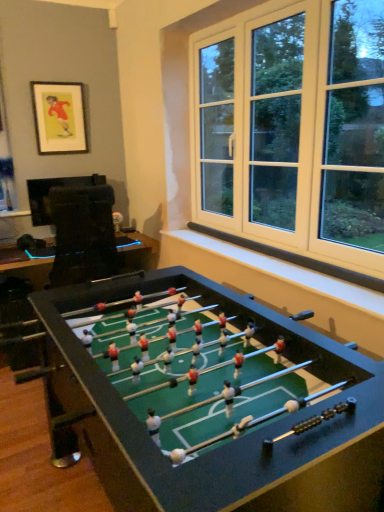
Question: Which direction should I rotate to look at green felt table at center, the first table in the bottom-to-top sequence?

Choices:
 (A) left
 (B) right

Answer: (A)

Question: Is green felt table at center, the second table viewed from the top, not near matte black picture frame at upper left?

Choices:
 (A) yes
 (B) no

Answer: (A)

Question: From the image's perspective, would you say green felt table at center, the second table viewed from the top, is positioned over matte black picture frame at upper left?

Choices:
 (A) no
 (B) yes

Answer: (A)

Question: Is green felt table at center, the first table in the bottom-to-top sequence, bigger than matte black picture frame at upper left?

Choices:
 (A) yes
 (B) no

Answer: (A)

Question: Is green felt table at center, the second table viewed from the top, smaller than matte black picture frame at upper left?

Choices:
 (A) yes
 (B) no

Answer: (B)

Question: Are green felt table at center, the second table viewed from the top, and matte black picture frame at upper left making contact?

Choices:
 (A) yes
 (B) no

Answer: (B)

Question: Can you confirm if green felt table at center, the first table in the bottom-to-top sequence, is positioned to the left of matte black picture frame at upper left?

Choices:
 (A) no
 (B) yes

Answer: (A)

Question: Considering the relative sizes of green felt table at center, the second table viewed from the top, and black glossy tv at left, the 2th table from the bottom, in the image provided, is green felt table at center, the second table viewed from the top, bigger than black glossy tv at left, the 2th table from the bottom,?

Choices:
 (A) no
 (B) yes

Answer: (B)

Question: From a real-world perspective, is green felt table at center, the first table in the bottom-to-top sequence, physically below black glossy tv at left, positioned as the 1th table in top-to-bottom order?

Choices:
 (A) no
 (B) yes

Answer: (B)

Question: Considering the relative sizes of green felt table at center, the second table viewed from the top, and black glossy tv at left, positioned as the 1th table in top-to-bottom order, in the image provided, is green felt table at center, the second table viewed from the top, shorter than black glossy tv at left, positioned as the 1th table in top-to-bottom order,?

Choices:
 (A) yes
 (B) no

Answer: (A)

Question: Does green felt table at center, the first table in the bottom-to-top sequence, have a smaller size compared to black glossy tv at left, positioned as the 1th table in top-to-bottom order?

Choices:
 (A) no
 (B) yes

Answer: (A)

Question: Is green felt table at center, the second table viewed from the top, behind black glossy tv at left, positioned as the 1th table in top-to-bottom order?

Choices:
 (A) yes
 (B) no

Answer: (B)

Question: Is green felt table at center, the second table viewed from the top, completely or partially outside of black glossy tv at left, the 2th table from the bottom?

Choices:
 (A) no
 (B) yes

Answer: (B)

Question: Is black glossy tv at left, the 2th table from the bottom, closer to camera compared to green felt table at center, the second table viewed from the top?

Choices:
 (A) yes
 (B) no

Answer: (B)